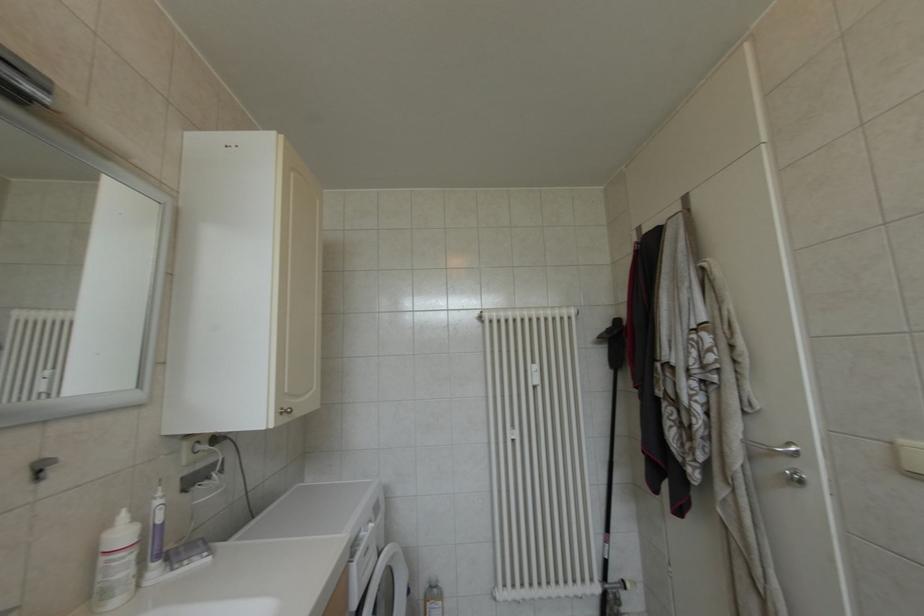
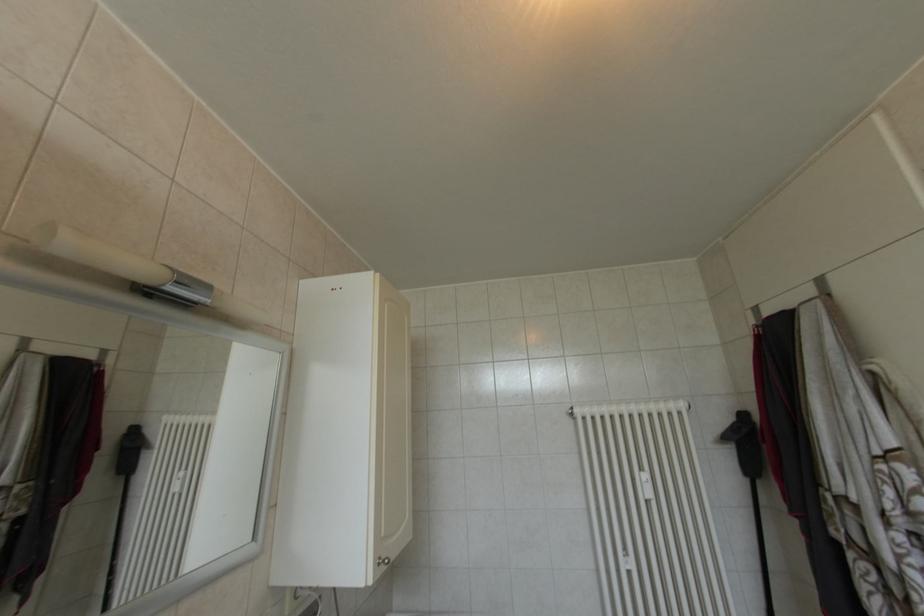
Question: What movement of the cameraman would produce the second image?

Choices:
 (A) Left
 (B) Right
 (C) Forward
 (D) Backward

Answer: (A)